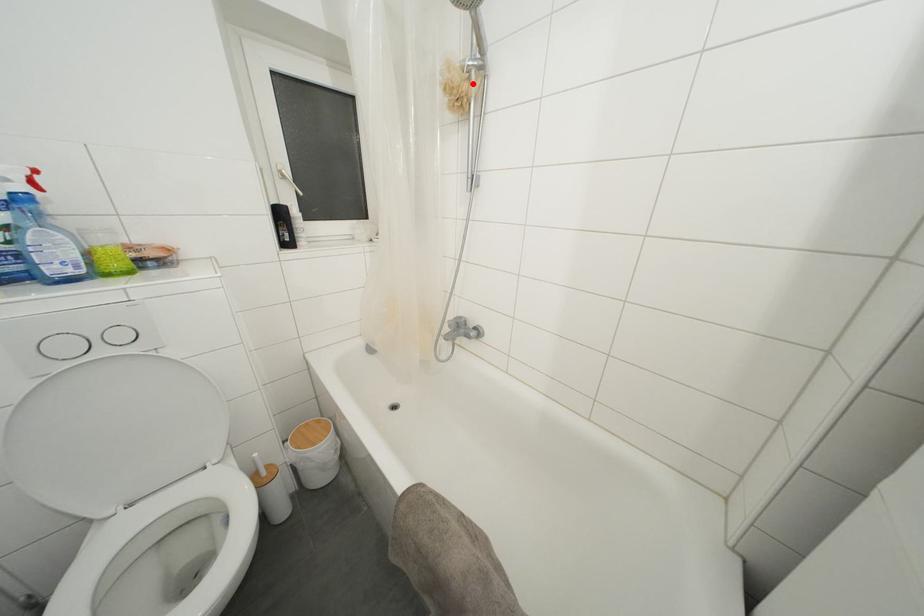
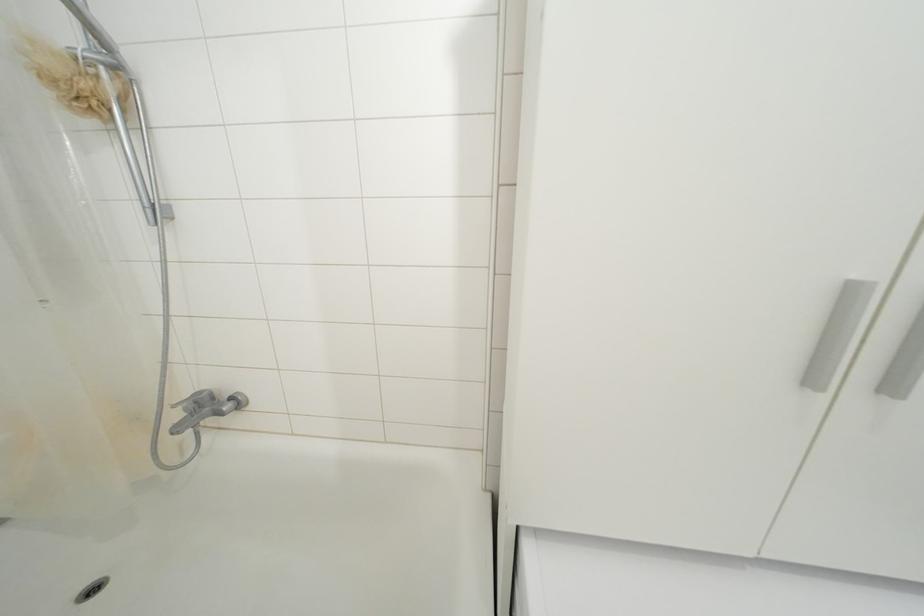
Locate, in the second image, the point that corresponds to the highlighted location in the first image.

(100, 79)